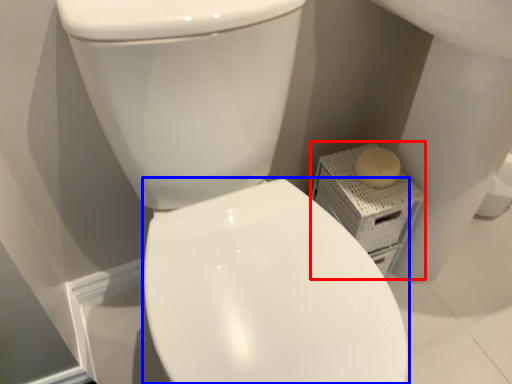
Question: Which point is closer to the camera, porcelain (highlighted by a red box) or bidet (highlighted by a blue box)?

Choices:
 (A) porcelain
 (B) bidet

Answer: (B)